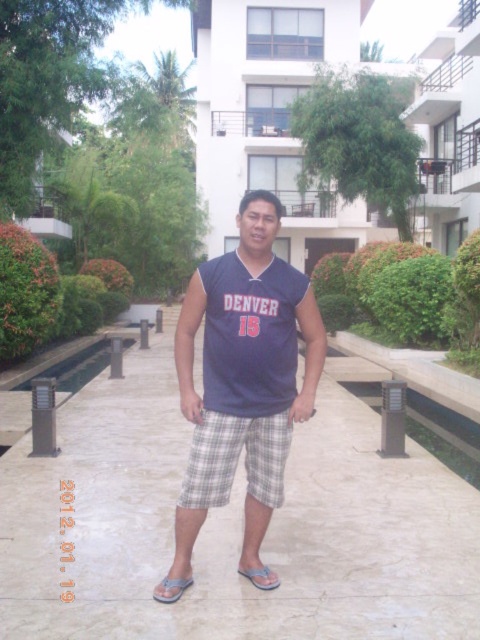
You are a delivery person trying to find the entrance to the building. You see a point marked at coordinate (231, 528). Is this point on the walkway leading to the building?

The point at coordinate (231, 528) is on the white marble pavement at center, which is the walkway leading to the building. Therefore, the point is on the walkway leading to the building.

Consider the image. You are a delivery person trying to place a package on the ground near the navy blue jersey at center. Can you confirm if the white marble pavement at center is a suitable surface to place the package?

The white marble pavement at center is below the navy blue jersey at center, so yes, the package can be placed on the white marble pavement at center since it is located under the jersey.